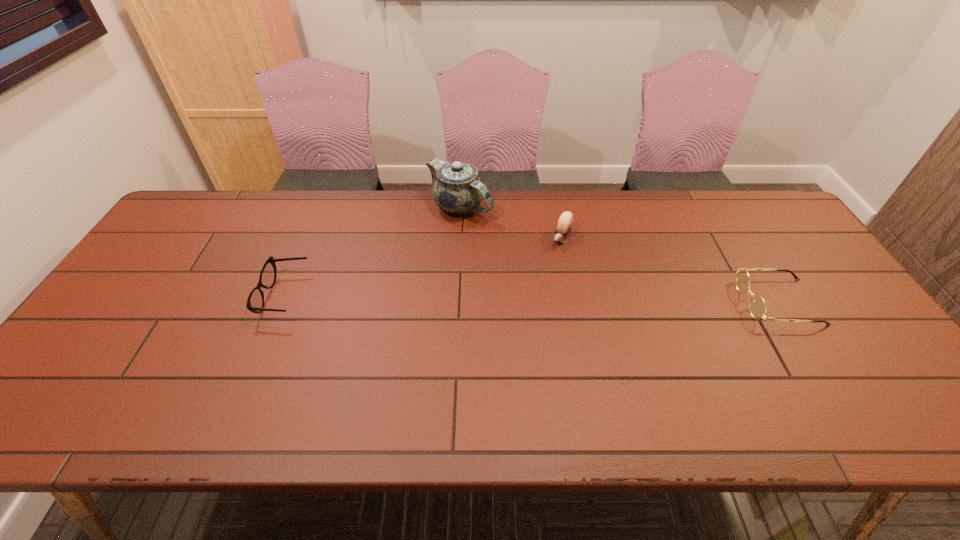
The image size is (960, 540). In order to click on free spot between the right spectacles and the leftmost object in this screenshot , I will do 531,299.

Identify the location of vacant space that's between the farthest object and the second object from right to left. (511, 222).

You are a GUI agent. You are given a task and a screenshot of the screen. Output one action in this format:
    pyautogui.click(x=<x>, y=<y>)
    Task: Click on the free space between the third nearest object and the farthest object
    This screenshot has height=540, width=960.
    Given the screenshot: What is the action you would take?
    pyautogui.click(x=511, y=222)

Where is `empty space that is in between the farthest object and the escargot`? empty space that is in between the farthest object and the escargot is located at coordinates (511, 222).

The height and width of the screenshot is (540, 960). Find the location of `vacant area between the left spectacles and the chinaware`. vacant area between the left spectacles and the chinaware is located at coordinates (372, 252).

Identify the location of free space between the right spectacles and the farthest object. The width and height of the screenshot is (960, 540). (619, 255).

Locate which object ranks in proximity to the tallest object. Please provide its 2D coordinates. Your answer should be formatted as a tuple, i.e. [(x, y)], where the tuple contains the x and y coordinates of a point satisfying the conditions above.

[(565, 222)]

Identify which object is the third nearest to the farthest object. Please provide its 2D coordinates. Your answer should be formatted as a tuple, i.e. [(x, y)], where the tuple contains the x and y coordinates of a point satisfying the conditions above.

[(757, 306)]